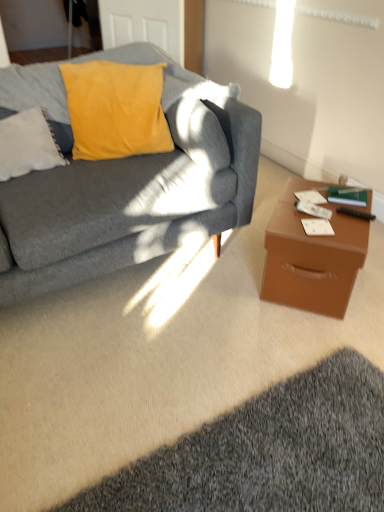
Where is `free space to the back side of dark gray shaggy rug at lower right`? This screenshot has width=384, height=512. free space to the back side of dark gray shaggy rug at lower right is located at coordinates tap(209, 330).